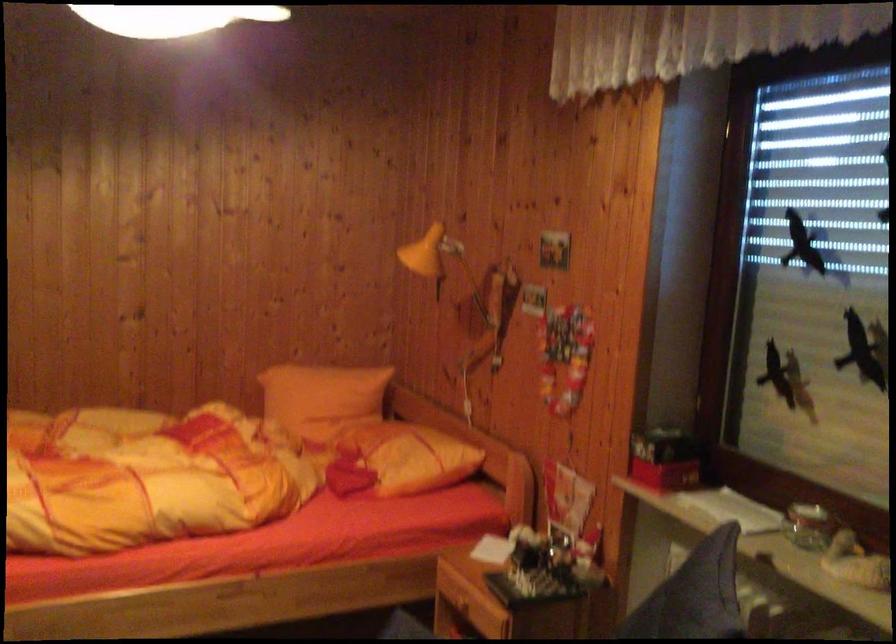
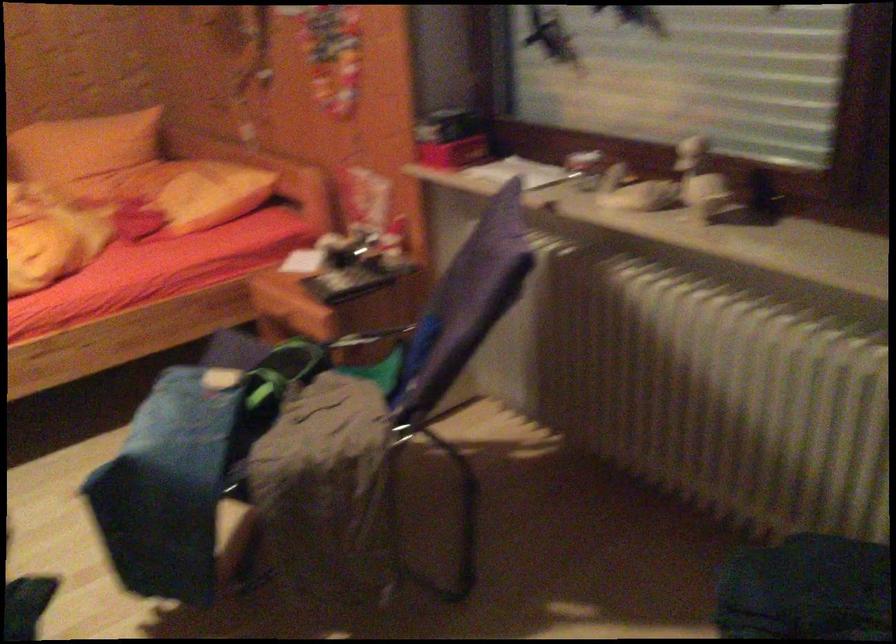
Question: Based on the continuous images, in which direction is the camera rotating? Reply with the corresponding letter.

Choices:
 (A) Left
 (B) Right
 (C) Up
 (D) Down

Answer: (D)